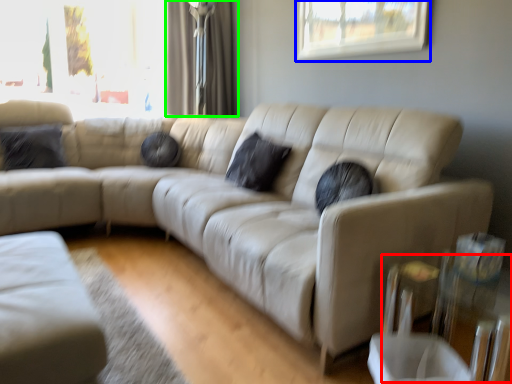
Question: Estimate the real-world distances between objects in this image. Which object is farther from glass table (highlighted by a red box), window (highlighted by a blue box) or curtain (highlighted by a green box)?

Choices:
 (A) window
 (B) curtain

Answer: (B)